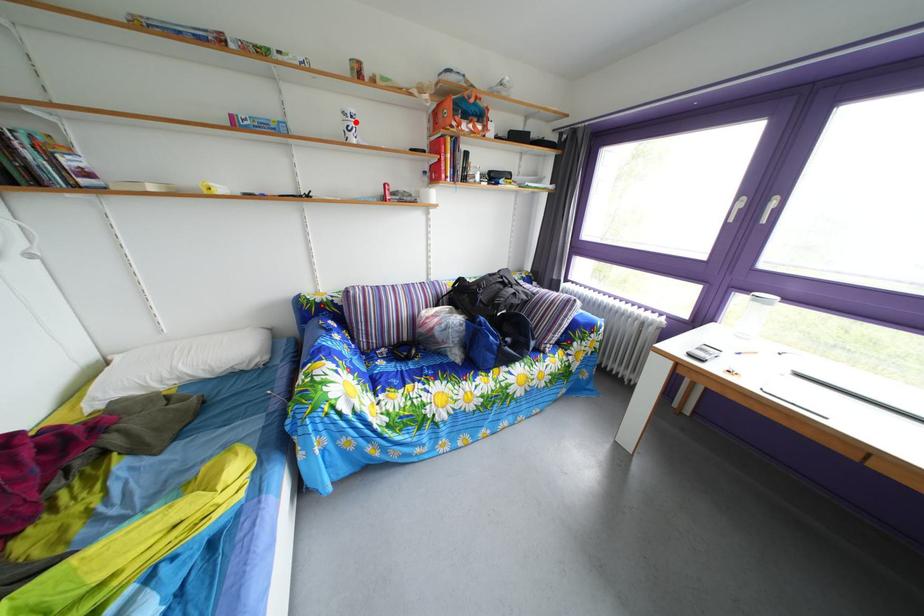
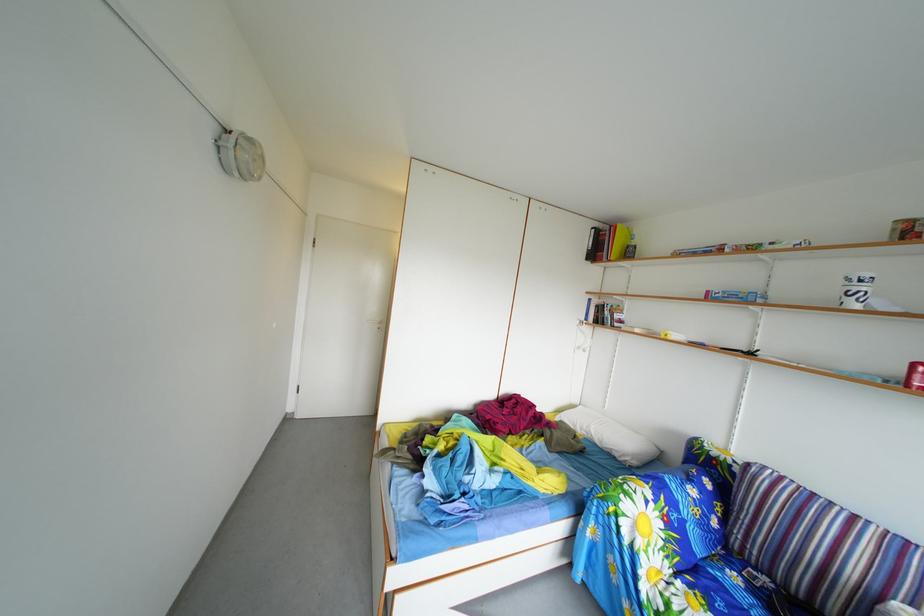
The point at the highlighted location is marked in the first image. Where is the corresponding point in the second image?

(859, 288)